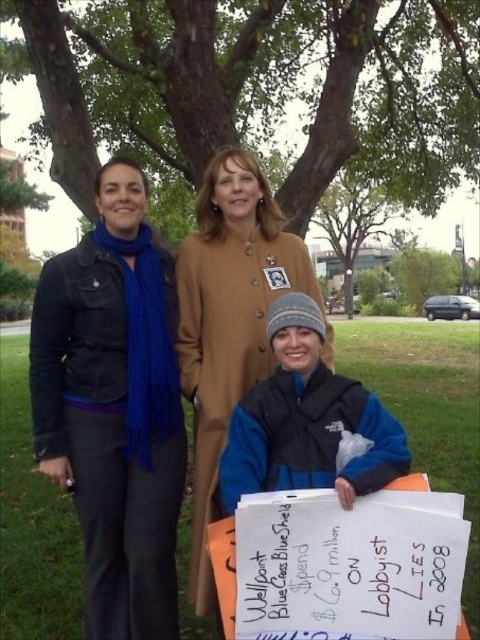
Image resolution: width=480 pixels, height=640 pixels. What do you see at coordinates (113, 406) in the screenshot?
I see `blue matte scarf at left` at bounding box center [113, 406].

Describe the element at coordinates (113, 406) in the screenshot. I see `blue matte scarf at left` at that location.

I want to click on blue matte scarf at left, so click(113, 406).

Can you confirm if blue fleece jacket at center is taller than green leafy tree at center?

Incorrect, blue fleece jacket at center's height is not larger of green leafy tree at center's.

Can you confirm if blue fleece jacket at center is thinner than green leafy tree at center?

Yes.

Between point (367, 406) and point (69, 243), which one is positioned behind?

The point (69, 243) is more distant.

At what (x,y) coordinates should I click in order to perform the action: click on blue fleece jacket at center. Please return your answer as a coordinate pair (x, y). Looking at the image, I should click on (308, 420).

Is matte brown coat at center to the left of green leafy tree at center from the viewer's perspective?

Indeed, matte brown coat at center is positioned on the left side of green leafy tree at center.

Does matte brown coat at center appear over green leafy tree at center?

No.

Find the location of a particular element. This screenshot has height=640, width=480. matte brown coat at center is located at coordinates (228, 321).